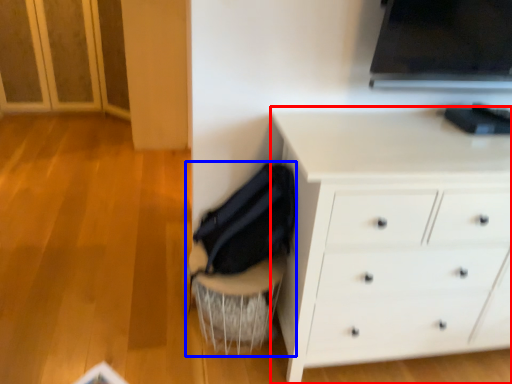
Question: Which point is closer to the camera, chest of drawers (highlighted by a red box) or swivel chair (highlighted by a blue box)?

Choices:
 (A) chest of drawers
 (B) swivel chair

Answer: (A)